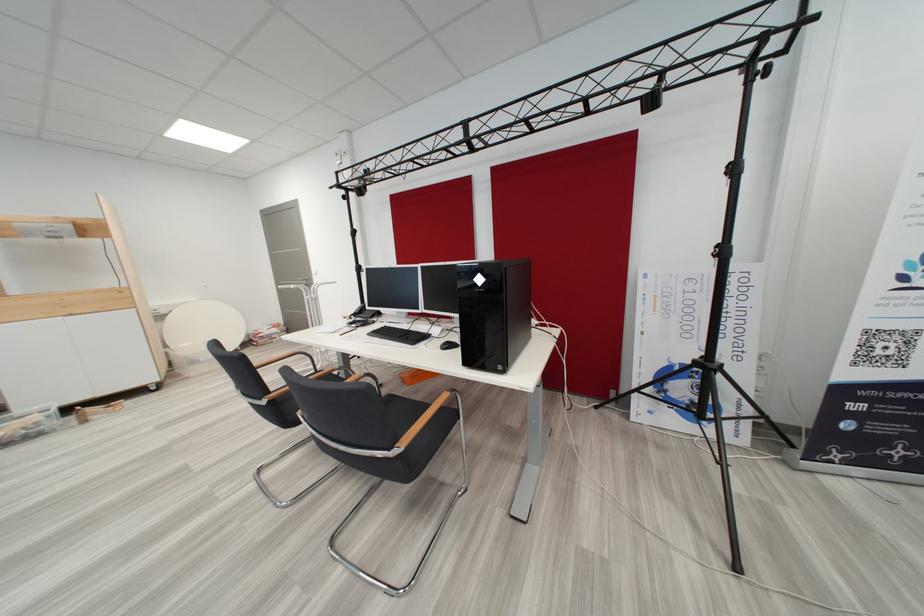
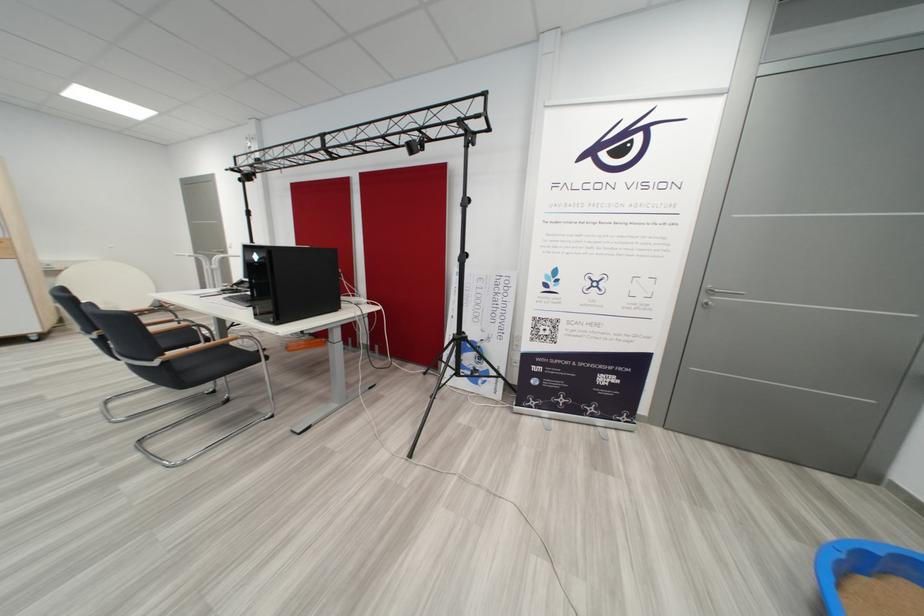
Which direction would the cameraman need to move to produce the second image?

The cameraman moved toward right, backward.